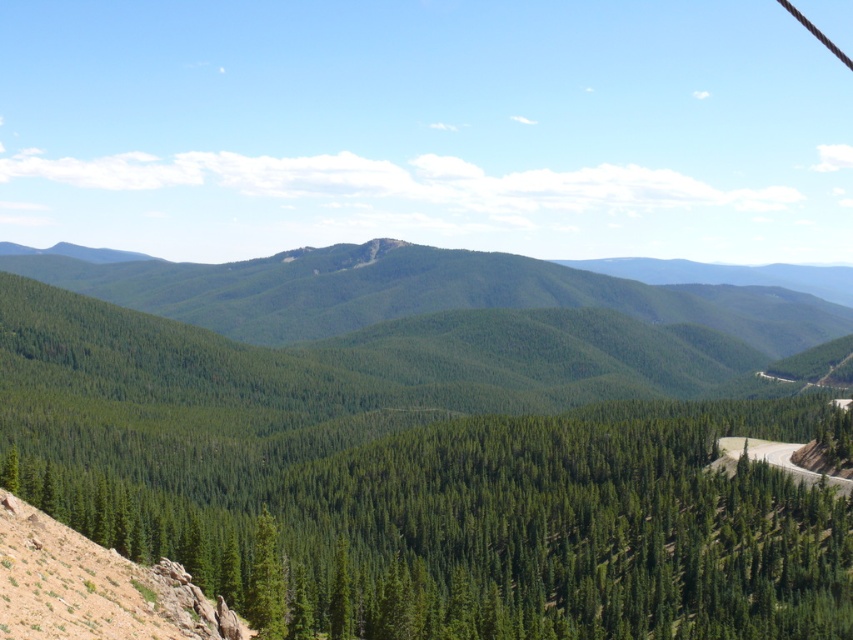
Question: Can you confirm if green textured trees at center is positioned to the left of green grassy mountain path at lower right?

Choices:
 (A) no
 (B) yes

Answer: (B)

Question: Which point is closer to the camera?

Choices:
 (A) (248, 570)
 (B) (808, 481)

Answer: (A)

Question: Is green textured trees at center further to camera compared to green grassy mountain path at lower right?

Choices:
 (A) yes
 (B) no

Answer: (B)

Question: Among these objects, which one is nearest to the camera?

Choices:
 (A) green textured trees at center
 (B) green grassy mountain path at lower right

Answer: (A)

Question: Is green textured trees at center to the left of green grassy mountain path at lower right from the viewer's perspective?

Choices:
 (A) yes
 (B) no

Answer: (A)